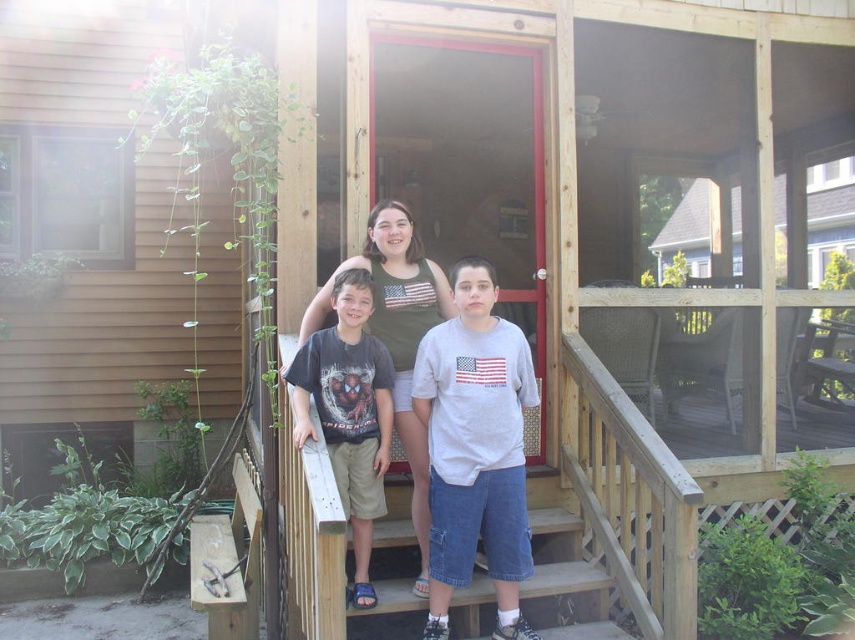
Question: Which of the following is the closest to the observer?

Choices:
 (A) (332, 291)
 (B) (497, 586)

Answer: (B)

Question: Based on their relative distances, which object is nearer to the denim at center?

Choices:
 (A) dark gray t-shirt at center
 (B) gray cotton t-shirt at center

Answer: (B)

Question: Does dark gray t-shirt at center have a lesser width compared to denim at center?

Choices:
 (A) yes
 (B) no

Answer: (A)

Question: Considering the relative positions of gray cotton t-shirt at center and dark gray t-shirt at center in the image provided, where is gray cotton t-shirt at center located with respect to dark gray t-shirt at center?

Choices:
 (A) below
 (B) above

Answer: (A)

Question: Observing the image, what is the correct spatial positioning of gray cotton t-shirt at center in reference to denim at center?

Choices:
 (A) right
 (B) left

Answer: (B)

Question: Which point appears farthest from the camera in this image?

Choices:
 (A) (469, 602)
 (B) (452, 332)

Answer: (A)